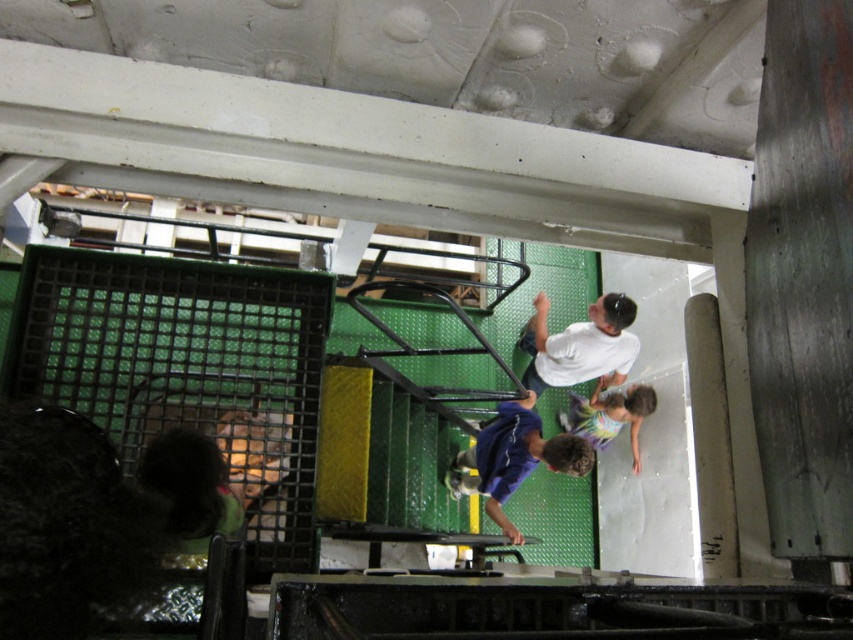
Is blue matte skateboard at center above white matte shirt at upper center?

Actually, blue matte skateboard at center is below white matte shirt at upper center.

Does blue matte skateboard at center appear on the left side of white matte shirt at upper center?

Indeed, blue matte skateboard at center is positioned on the left side of white matte shirt at upper center.

Which is behind, point (457, 486) or point (570, 365)?

Positioned behind is point (570, 365).

Locate an element on the screen. blue matte skateboard at center is located at coordinates (514, 458).

Does white matte shirt at upper center appear under multicolored striped swimsuit at center?

No, white matte shirt at upper center is not below multicolored striped swimsuit at center.

Between white matte shirt at upper center and multicolored striped swimsuit at center, which one is positioned lower?

multicolored striped swimsuit at center is below.

Between point (608, 339) and point (596, 400), which one is positioned in front?

Point (608, 339) is in front.

Image resolution: width=853 pixels, height=640 pixels. In order to click on white matte shirt at upper center in this screenshot , I will do `click(579, 346)`.

Who is positioned more to the left, blue matte skateboard at center or multicolored striped swimsuit at center?

blue matte skateboard at center is more to the left.

Does blue matte skateboard at center appear under multicolored striped swimsuit at center?

Correct, blue matte skateboard at center is located below multicolored striped swimsuit at center.

Find the location of a particular element. This screenshot has width=853, height=640. blue matte skateboard at center is located at coordinates (514, 458).